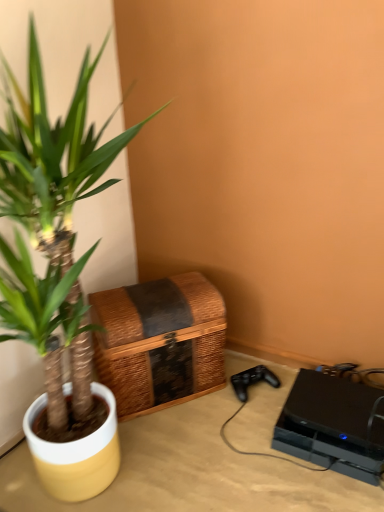
Image resolution: width=384 pixels, height=512 pixels. What are the coordinates of `vacant space situated on the left part of black matte gaming console at lower right` in the screenshot? It's located at [243, 446].